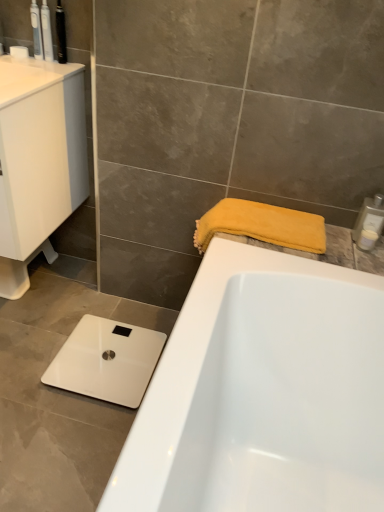
Identify the location of vacant area on top of yellow soft towel at upper right (from a real-world perspective). This screenshot has width=384, height=512. (265, 214).